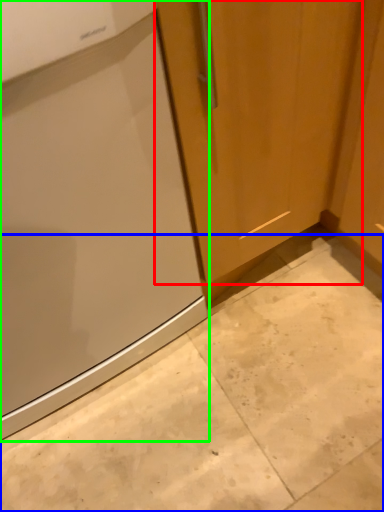
Question: Which object is positioned closest to door (highlighted by a red box)? Select from concrete (highlighted by a blue box) and home appliance (highlighted by a green box).

Choices:
 (A) concrete
 (B) home appliance

Answer: (B)